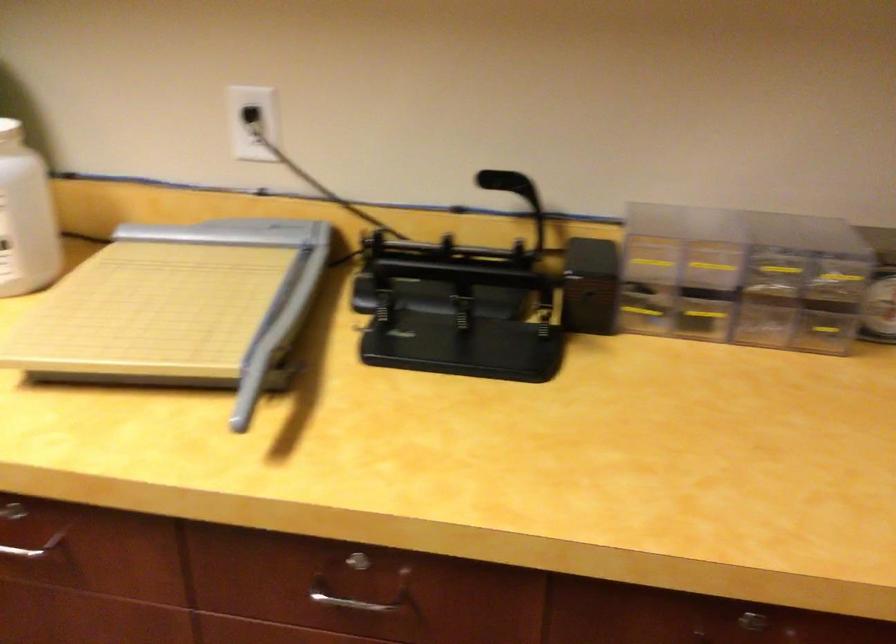
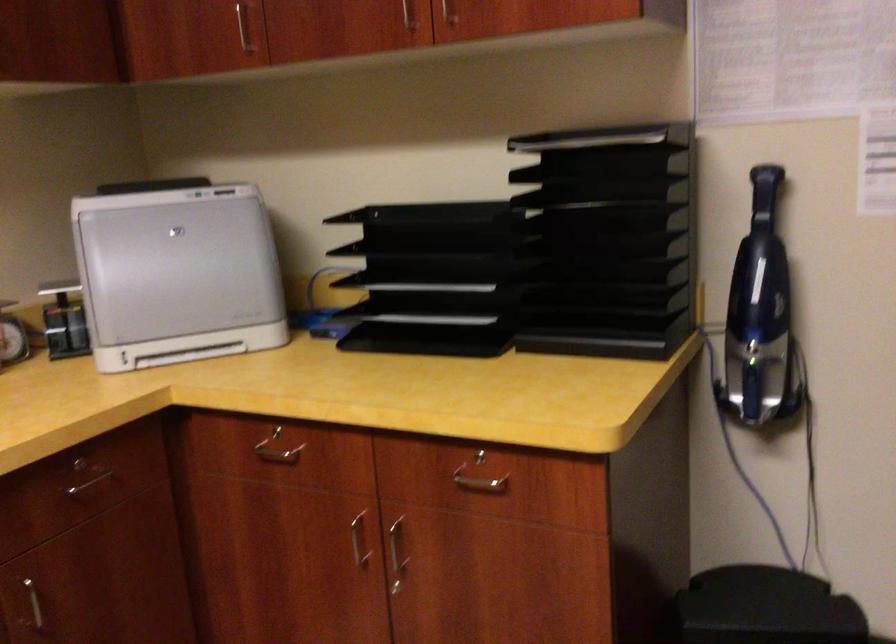
Question: The camera is either moving clockwise (left) or counter-clockwise (right) around the object. The first image is from the beginning of the video and the second image is from the end. Is the camera moving left or right when shooting the video?

Choices:
 (A) Left
 (B) Right

Answer: (A)